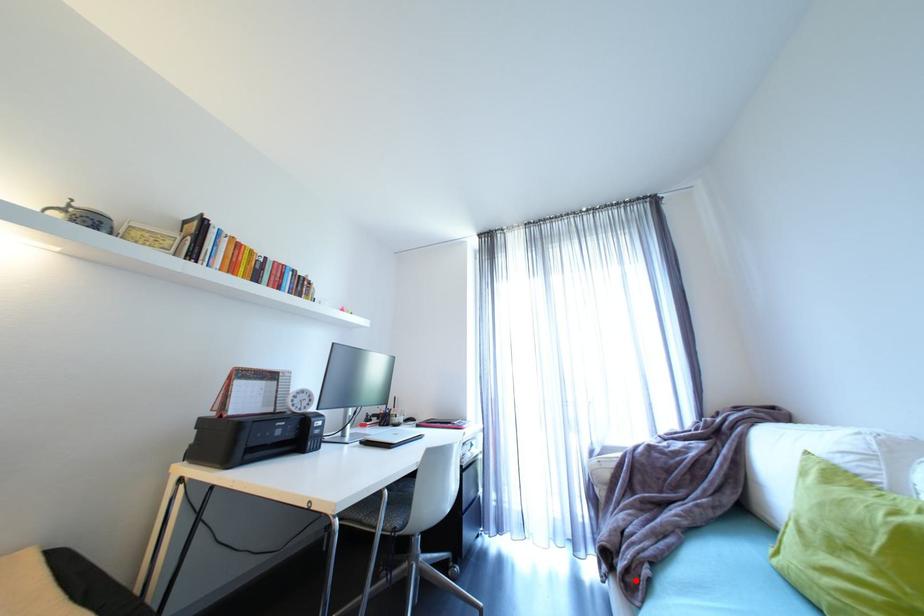
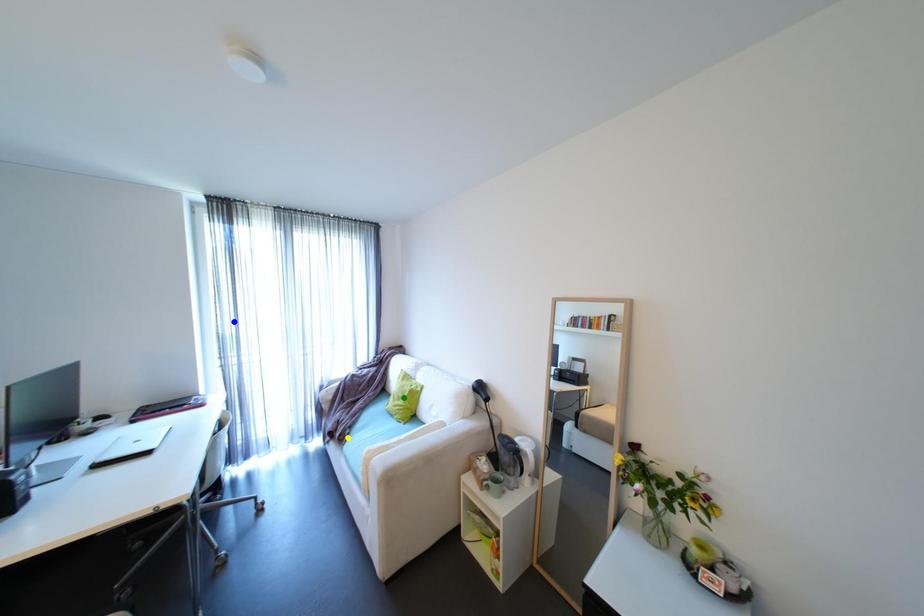
Question: I am providing you with two images of the same scene from different viewpoints. A red point is marked on the first image. You are given multiple points on the second image. Can you choose the point in image 2 that corresponds to the point in image 1?

Choices:
 (A) green point
 (B) yellow point
 (C) blue point

Answer: (B)